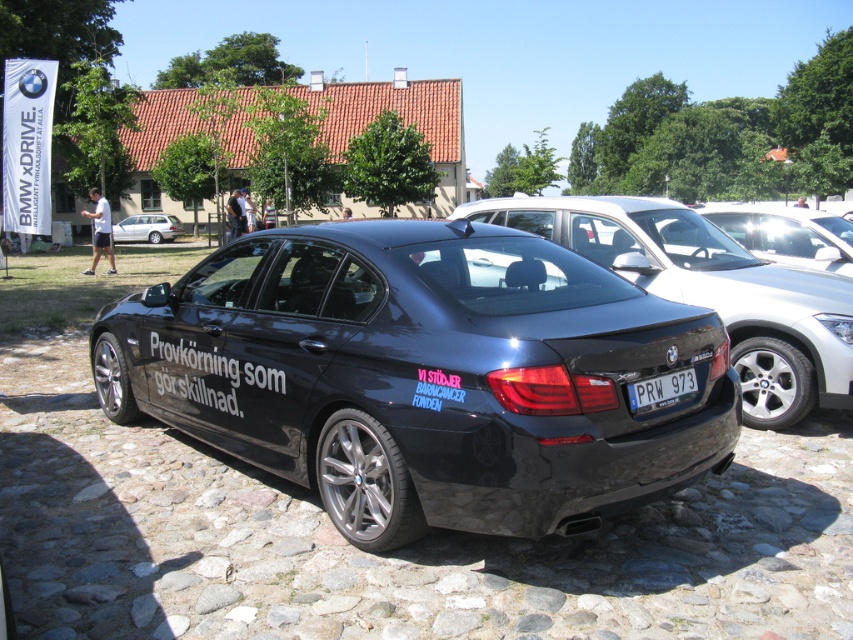
You are standing at the point labeled point (799, 401) and want to walk to the camera position. The path is clear. How far will you have to walk?

You will have to walk 5.41 meters to reach the camera position from point (799, 401).

You are a photographer at an outdoor event and need to capture the glossy black car at center and the white plastic license plate at center in a single shot. Can you position yourself so that both are fully visible without any part of them being blocked by other objects in the scene?

The white plastic license plate at center is behind the glossy black car at center, so positioning yourself in front of the glossy black car at center would allow you to see both the glossy black car at center and the white plastic license plate at center without obstruction.

You are a photographer trying to capture both the glossy black sedan at center and the glossy black car at center in a single shot. Given that your camera frame can only accommodate objects up to the width of the wider vehicle, which vehicle should you position closer to the edge of the frame to ensure both fit?

Since the glossy black sedan at center is wider than the glossy black car at center, you should position the glossy black car at center closer to the edge of the frame to ensure both fit within the camera frame.